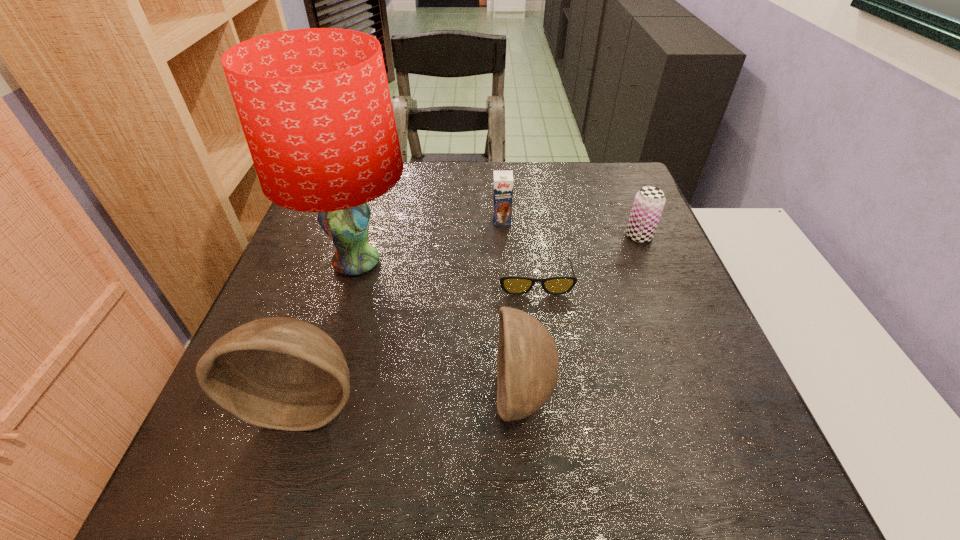
Please show where to add a bowl on the right while keeping spacing even. Please provide its 2D coordinates. Your answer should be formatted as a tuple, i.e. [(x, y)], where the tuple contains the x and y coordinates of a point satisfying the conditions above.

[(735, 388)]